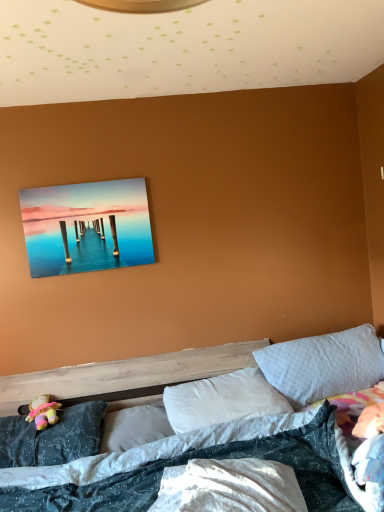
Question: Should I look upward or downward to see dark blue fabric pillow at lower left, which is counted as the first pillow, starting from the left?

Choices:
 (A) up
 (B) down

Answer: (B)

Question: Is white soft pillow at upper right, the 4th pillow viewed from the left, taller than metallic glossy painting at upper center?

Choices:
 (A) no
 (B) yes

Answer: (A)

Question: Is white soft pillow at upper right, the 4th pillow viewed from the left, looking in the opposite direction of metallic glossy painting at upper center?

Choices:
 (A) no
 (B) yes

Answer: (A)

Question: From the image's perspective, does white soft pillow at upper right, the 4th pillow viewed from the left, appear lower than metallic glossy painting at upper center?

Choices:
 (A) no
 (B) yes

Answer: (B)

Question: Does white soft pillow at upper right, positioned as the 1th pillow in right-to-left order, have a smaller size compared to metallic glossy painting at upper center?

Choices:
 (A) yes
 (B) no

Answer: (B)

Question: Can you confirm if white soft pillow at upper right, positioned as the 1th pillow in right-to-left order, is wider than metallic glossy painting at upper center?

Choices:
 (A) yes
 (B) no

Answer: (A)

Question: Considering the relative sizes of white soft pillow at upper right, the 4th pillow viewed from the left, and metallic glossy painting at upper center in the image provided, is white soft pillow at upper right, the 4th pillow viewed from the left, shorter than metallic glossy painting at upper center?

Choices:
 (A) no
 (B) yes

Answer: (B)

Question: Does metallic glossy painting at upper center come behind white soft pillow at center, placed as the third pillow when sorted from right to left?

Choices:
 (A) no
 (B) yes

Answer: (B)

Question: Does metallic glossy painting at upper center have a greater width compared to white soft pillow at center, the second pillow in the left-to-right sequence?

Choices:
 (A) no
 (B) yes

Answer: (A)

Question: Is metallic glossy painting at upper center in contact with white soft pillow at center, the second pillow in the left-to-right sequence?

Choices:
 (A) no
 (B) yes

Answer: (A)

Question: From the image's perspective, is metallic glossy painting at upper center on white soft pillow at center, placed as the third pillow when sorted from right to left?

Choices:
 (A) no
 (B) yes

Answer: (B)

Question: Would you say metallic glossy painting at upper center is outside white soft pillow at center, placed as the third pillow when sorted from right to left?

Choices:
 (A) yes
 (B) no

Answer: (A)

Question: From a real-world perspective, is metallic glossy painting at upper center on white soft pillow at center, placed as the third pillow when sorted from right to left?

Choices:
 (A) yes
 (B) no

Answer: (A)

Question: From the image's perspective, is white soft pillow at center, arranged as the 3th pillow when viewed from the left, below metallic glossy painting at upper center?

Choices:
 (A) no
 (B) yes

Answer: (B)